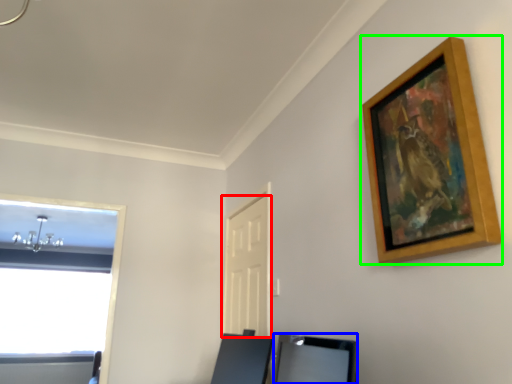
Question: Estimate the real-world distances between objects in this image. Which object is farther from door (highlighted by a red box), vanity (highlighted by a blue box) or picture frame (highlighted by a green box)?

Choices:
 (A) vanity
 (B) picture frame

Answer: (B)